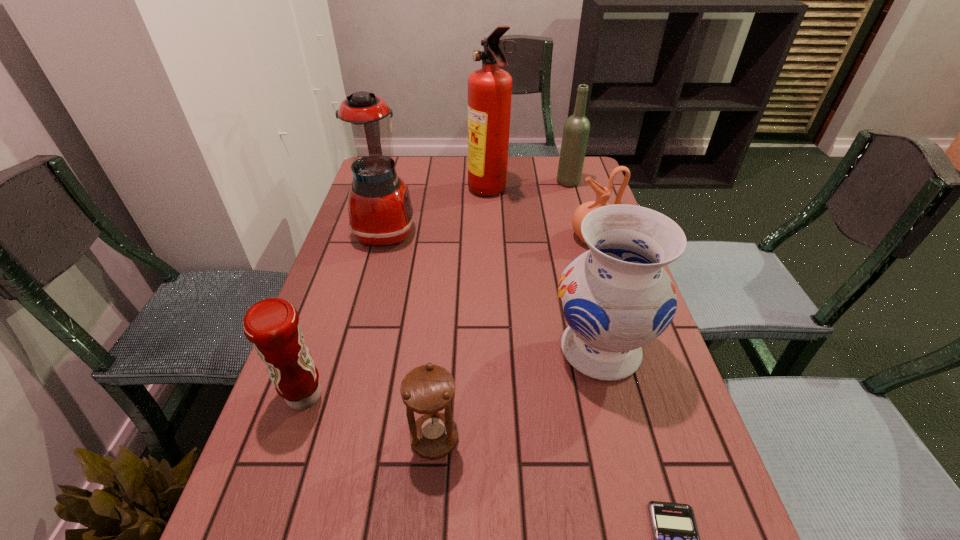
Where is `food processor that is positioned at the left edge`? food processor that is positioned at the left edge is located at coordinates (380, 211).

The width and height of the screenshot is (960, 540). In order to click on condiment that is at the left edge in this screenshot , I will do `click(272, 325)`.

I want to click on wine bottle located at the right edge, so click(x=576, y=130).

This screenshot has width=960, height=540. In order to click on vase present at the right edge in this screenshot , I will do pyautogui.click(x=616, y=297).

The width and height of the screenshot is (960, 540). Identify the location of pottery present at the right edge. (603, 194).

Find the location of a particular element. This screenshot has width=960, height=540. object at the far right corner is located at coordinates (576, 130).

Find the location of a particular element. This screenshot has height=540, width=960. blank space at the far edge of the desktop is located at coordinates (438, 160).

Where is `free region at the left edge`? free region at the left edge is located at coordinates (347, 283).

Find the location of `free location at the right edge of the desktop`. free location at the right edge of the desktop is located at coordinates (660, 346).

The height and width of the screenshot is (540, 960). Identify the location of blank space at the far left corner. (401, 170).